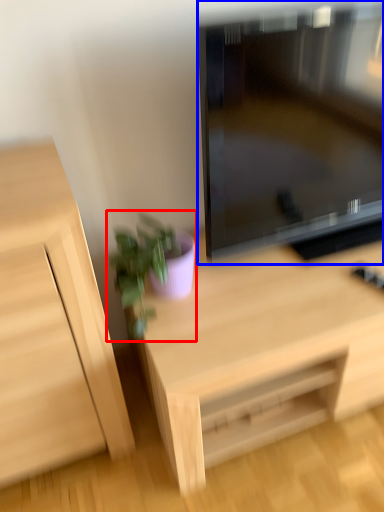
Question: Which of the following is the closest to the observer, houseplant (highlighted by a red box) or television (highlighted by a blue box)?

Choices:
 (A) houseplant
 (B) television

Answer: (B)